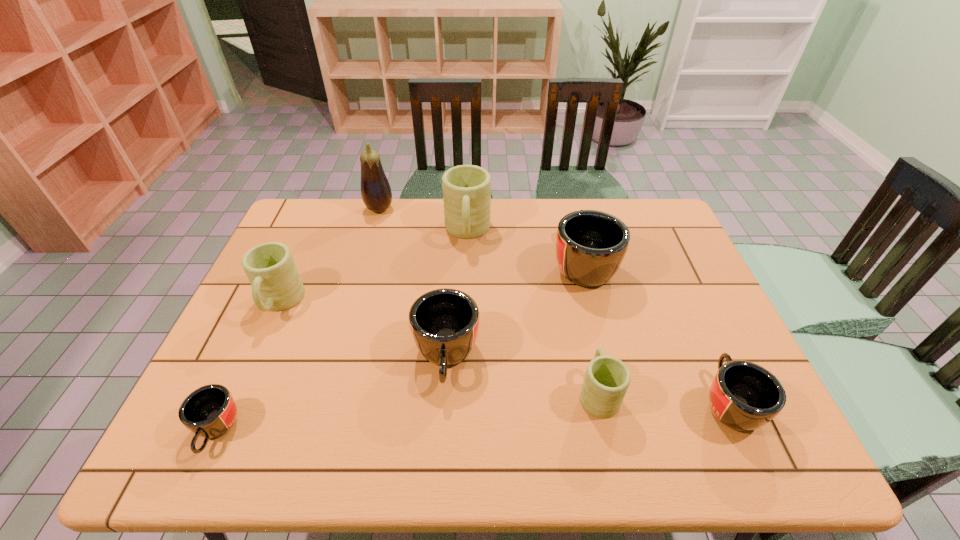
The height and width of the screenshot is (540, 960). I want to click on the tallest object, so click(376, 193).

The width and height of the screenshot is (960, 540). In order to click on eggplant in this screenshot , I will do `click(376, 193)`.

The width and height of the screenshot is (960, 540). I want to click on the farthest green mug, so click(x=466, y=188).

You are a GUI agent. You are given a task and a screenshot of the screen. Output one action in this format:
    pyautogui.click(x=<x>, y=<y>)
    Task: Click on the biggest green mug
    
    Given the screenshot: What is the action you would take?
    pyautogui.click(x=466, y=188)

Image resolution: width=960 pixels, height=540 pixels. Find the location of `the biggest red mug`. the biggest red mug is located at coordinates (590, 245).

You are a GUI agent. You are given a task and a screenshot of the screen. Output one action in this format:
    pyautogui.click(x=<x>, y=<y>)
    Task: Click on the farthest red mug
    
    Given the screenshot: What is the action you would take?
    pyautogui.click(x=590, y=245)

You are a GUI agent. You are given a task and a screenshot of the screen. Output one action in this format:
    pyautogui.click(x=<x>, y=<y>)
    Task: Click on the second smallest green mug
    
    Given the screenshot: What is the action you would take?
    pyautogui.click(x=276, y=284)

Locate an element on the screen. This screenshot has height=540, width=960. the second nearest green mug is located at coordinates point(276,284).

Where is `the second biggest red mug`? The height and width of the screenshot is (540, 960). the second biggest red mug is located at coordinates (444, 323).

Identify the location of the smallest green mug. The height and width of the screenshot is (540, 960). (606, 381).